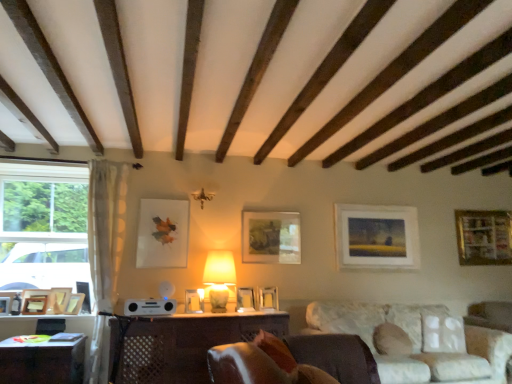
Question: From the image's perspective, would you say matte beige lamp at center is shown under wooden picture frame at left, which ranks as the fifth picture frame in left-to-right order?

Choices:
 (A) yes
 (B) no

Answer: (B)

Question: Considering the relative sizes of matte beige lamp at center and wooden picture frame at left, the 8th picture frame when ordered from right to left, in the image provided, is matte beige lamp at center smaller than wooden picture frame at left, the 8th picture frame when ordered from right to left,?

Choices:
 (A) yes
 (B) no

Answer: (B)

Question: From a real-world perspective, is matte beige lamp at center physically below wooden picture frame at left, which ranks as the fifth picture frame in left-to-right order?

Choices:
 (A) no
 (B) yes

Answer: (A)

Question: Is matte beige lamp at center turned away from wooden picture frame at left, which ranks as the fifth picture frame in left-to-right order?

Choices:
 (A) no
 (B) yes

Answer: (A)

Question: Considering the relative sizes of matte beige lamp at center and wooden picture frame at left, which ranks as the fifth picture frame in left-to-right order, in the image provided, is matte beige lamp at center thinner than wooden picture frame at left, which ranks as the fifth picture frame in left-to-right order,?

Choices:
 (A) yes
 (B) no

Answer: (B)

Question: Is matte beige lamp at center not close to wooden picture frame at left, which ranks as the fifth picture frame in left-to-right order?

Choices:
 (A) yes
 (B) no

Answer: (A)

Question: Is satin silver speaker at center taller than wooden picture frame at lower left, positioned as the ninth picture frame in right-to-left order?

Choices:
 (A) yes
 (B) no

Answer: (B)

Question: Does satin silver speaker at center appear on the right side of wooden picture frame at lower left, positioned as the ninth picture frame in right-to-left order?

Choices:
 (A) yes
 (B) no

Answer: (A)

Question: Is satin silver speaker at center positioned before wooden picture frame at lower left, positioned as the ninth picture frame in right-to-left order?

Choices:
 (A) yes
 (B) no

Answer: (A)

Question: From a real-world perspective, is satin silver speaker at center below wooden picture frame at lower left, which is counted as the 4th picture frame, starting from the left?

Choices:
 (A) yes
 (B) no

Answer: (A)

Question: Is satin silver speaker at center not within wooden picture frame at lower left, positioned as the ninth picture frame in right-to-left order?

Choices:
 (A) no
 (B) yes

Answer: (B)

Question: Does satin silver speaker at center have a smaller size compared to wooden picture frame at lower left, positioned as the ninth picture frame in right-to-left order?

Choices:
 (A) no
 (B) yes

Answer: (A)

Question: From the image's perspective, is wooden table at lower left, which ranks as the 1th table in left-to-right order, located beneath wooden picture frame at right, the 1th picture frame viewed from the right?

Choices:
 (A) no
 (B) yes

Answer: (B)